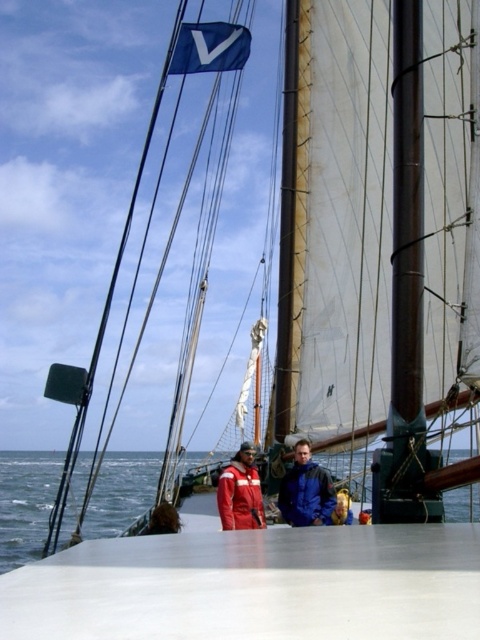
Question: Based on their relative distances, which object is nearer to the blue water at lower left?

Choices:
 (A) red matte jacket at center
 (B) blue matte jacket at center
 (C) golden hair at center
 (D) blue fabric flag at upper center

Answer: (B)

Question: Is red matte jacket at center to the left of golden hair at center from the viewer's perspective?

Choices:
 (A) no
 (B) yes

Answer: (B)

Question: Among these objects, which one is nearest to the camera?

Choices:
 (A) blue water at lower left
 (B) blue matte jacket at center
 (C) red matte jacket at center
 (D) blue fabric flag at upper center

Answer: (A)

Question: Is blue matte jacket at center to the left of golden hair at center from the viewer's perspective?

Choices:
 (A) yes
 (B) no

Answer: (A)

Question: Does blue matte jacket at center have a lesser width compared to golden hair at center?

Choices:
 (A) no
 (B) yes

Answer: (A)

Question: Which point is farther to the camera?

Choices:
 (A) blue fabric flag at upper center
 (B) red matte jacket at center
 (C) golden hair at center

Answer: (A)